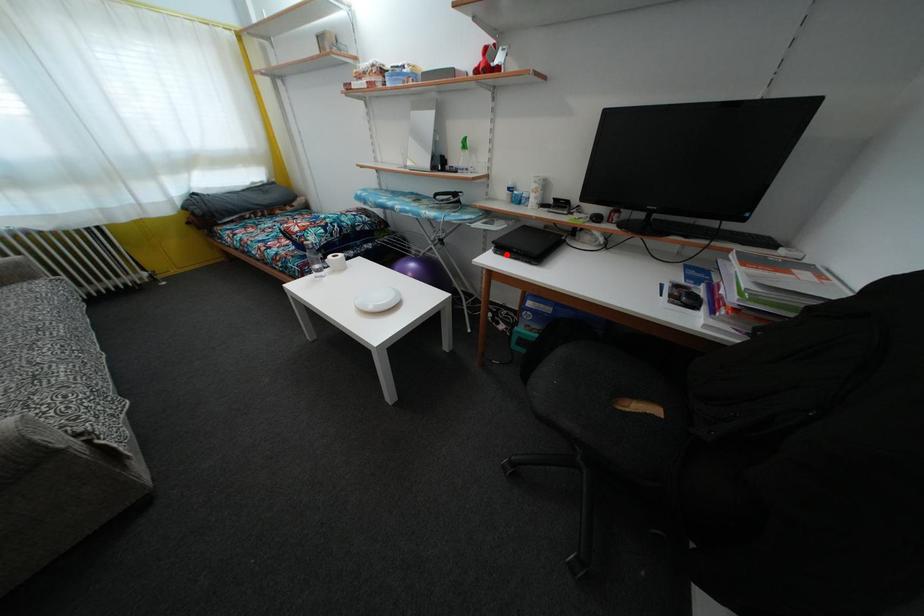
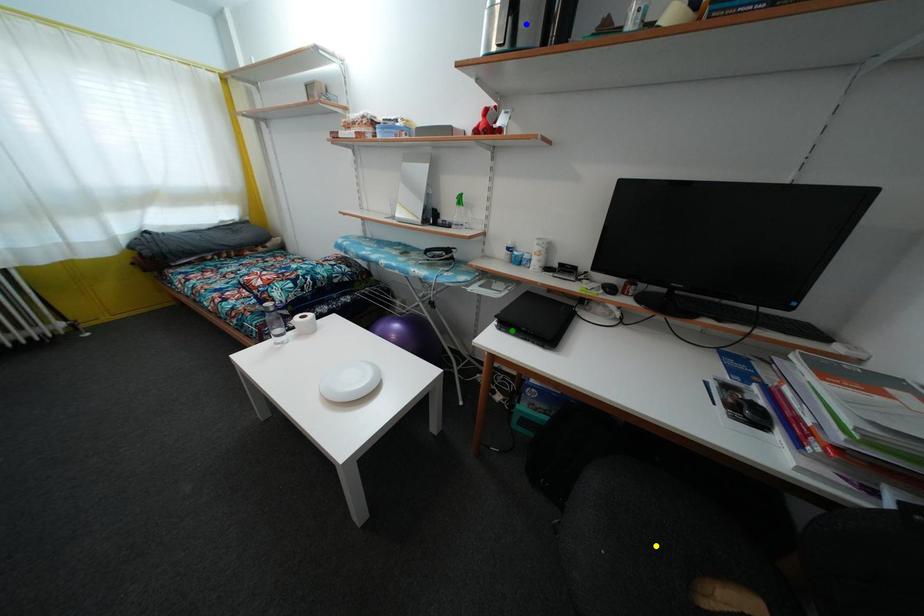
Question: I am providing you with two images of the same scene from different viewpoints. A red point is marked on the first image. You are given multiple points on the second image. Which spot in image 2 lines up with the point in image 1?

Choices:
 (A) blue point
 (B) yellow point
 (C) green point

Answer: (C)